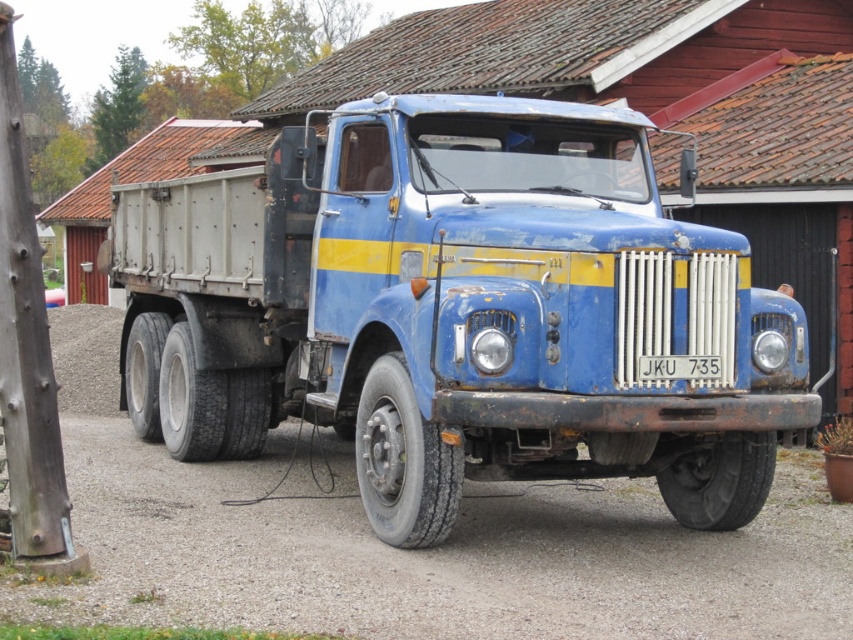
Question: Is rusty metal trailer truck at center in front of rusty metal dirt track at center?

Choices:
 (A) no
 (B) yes

Answer: (A)

Question: Which point is closer to the camera taking this photo?

Choices:
 (A) click(375, 300)
 (B) click(480, 570)

Answer: (B)

Question: Is rusty metal trailer truck at center behind rusty metal dirt track at center?

Choices:
 (A) yes
 (B) no

Answer: (A)

Question: Can you confirm if rusty metal trailer truck at center is smaller than rusty metal dirt track at center?

Choices:
 (A) yes
 (B) no

Answer: (A)

Question: Which point appears closest to the camera in this image?

Choices:
 (A) click(166, 364)
 (B) click(558, 522)

Answer: (B)